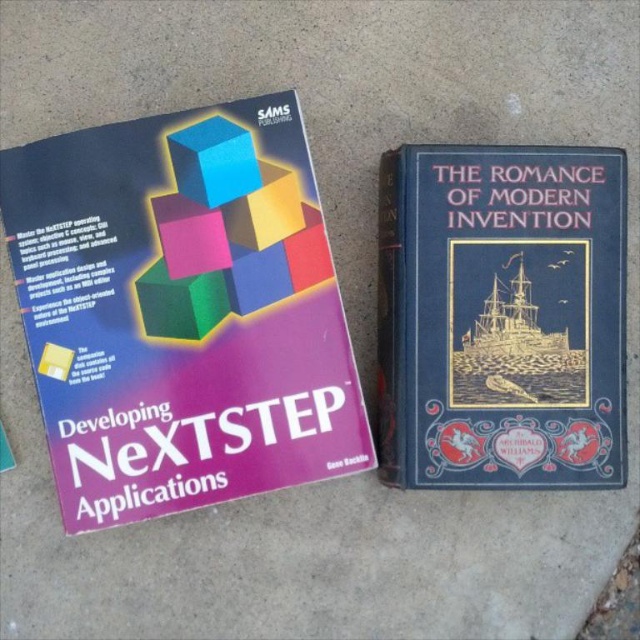
You are organizing a library shelf and need to place both the blue hardcover book at right and the blue matte cube at upper left. Given their sizes, which one should you place first to ensure proper arrangement?

The blue hardcover book at right is larger than the blue matte cube at upper left, so you should place the blue hardcover book at right first to accommodate its size before placing the smaller cube.

You have a shelf that can only hold books up to the width of the blue hardcover book at right. Can the matte purple book at left fit on the same shelf without overlapping?

The matte purple book at left is wider than the blue hardcover book at right, so it cannot fit on the shelf designed for the blue hardcover book at right without overlapping.